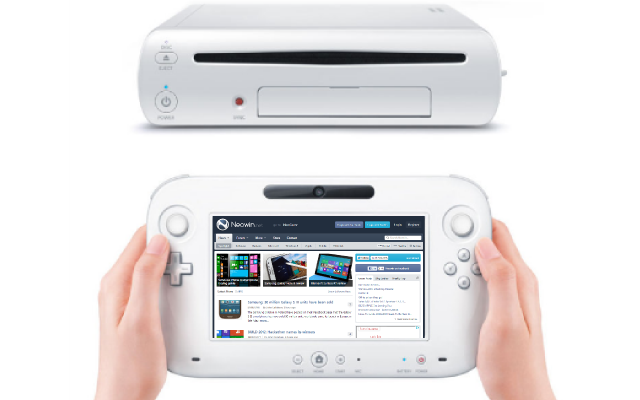
Image resolution: width=640 pixels, height=400 pixels. I want to click on light, so click(237, 101).